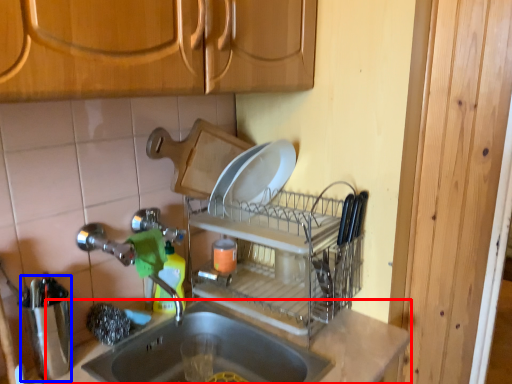
Question: Which of the following is the farthest to the observer, countertop (highlighted by a red box) or appliance (highlighted by a blue box)?

Choices:
 (A) countertop
 (B) appliance

Answer: (B)